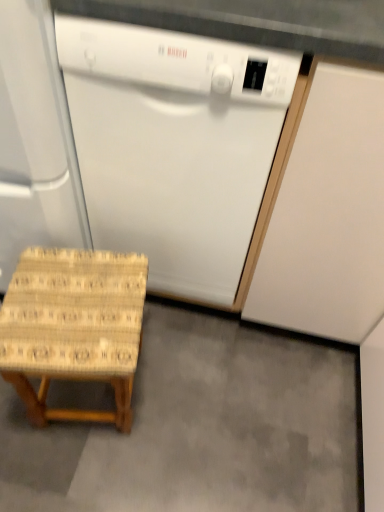
Question: Can you confirm if white matte cabinet at right is positioned to the right of white glossy dishwasher at center?

Choices:
 (A) yes
 (B) no

Answer: (A)

Question: Is white matte cabinet at right beside white glossy dishwasher at center?

Choices:
 (A) no
 (B) yes

Answer: (A)

Question: Does white matte cabinet at right have a smaller size compared to white glossy dishwasher at center?

Choices:
 (A) no
 (B) yes

Answer: (A)

Question: Can you confirm if white matte cabinet at right is bigger than white glossy dishwasher at center?

Choices:
 (A) no
 (B) yes

Answer: (B)

Question: Is there a large distance between white matte cabinet at right and white glossy dishwasher at center?

Choices:
 (A) yes
 (B) no

Answer: (B)

Question: Can you confirm if white matte cabinet at right is shorter than white glossy dishwasher at center?

Choices:
 (A) yes
 (B) no

Answer: (A)

Question: Is woven wood stool at lower left at the right side of white matte dishwasher at left?

Choices:
 (A) yes
 (B) no

Answer: (A)

Question: Is woven wood stool at lower left located outside white matte dishwasher at left?

Choices:
 (A) no
 (B) yes

Answer: (B)

Question: Are woven wood stool at lower left and white matte dishwasher at left located far from each other?

Choices:
 (A) yes
 (B) no

Answer: (B)

Question: From the image's perspective, is woven wood stool at lower left above white matte dishwasher at left?

Choices:
 (A) no
 (B) yes

Answer: (A)

Question: Could you tell me if woven wood stool at lower left is turned towards white matte dishwasher at left?

Choices:
 (A) no
 (B) yes

Answer: (A)

Question: Is woven wood stool at lower left next to white matte dishwasher at left?

Choices:
 (A) yes
 (B) no

Answer: (B)

Question: Would you say woven wood stool at lower left contains woven wood stool at lower left?

Choices:
 (A) no
 (B) yes

Answer: (A)